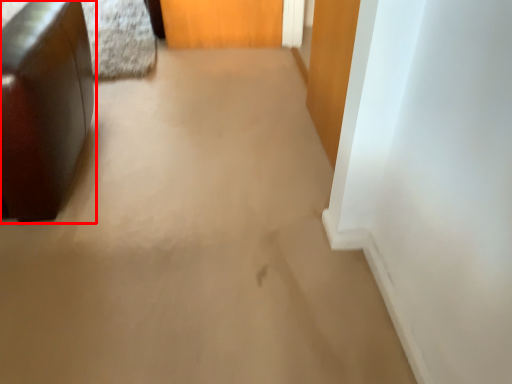
Question: Where is furniture (annotated by the red box) located in relation to door in the image?

Choices:
 (A) right
 (B) left

Answer: (B)